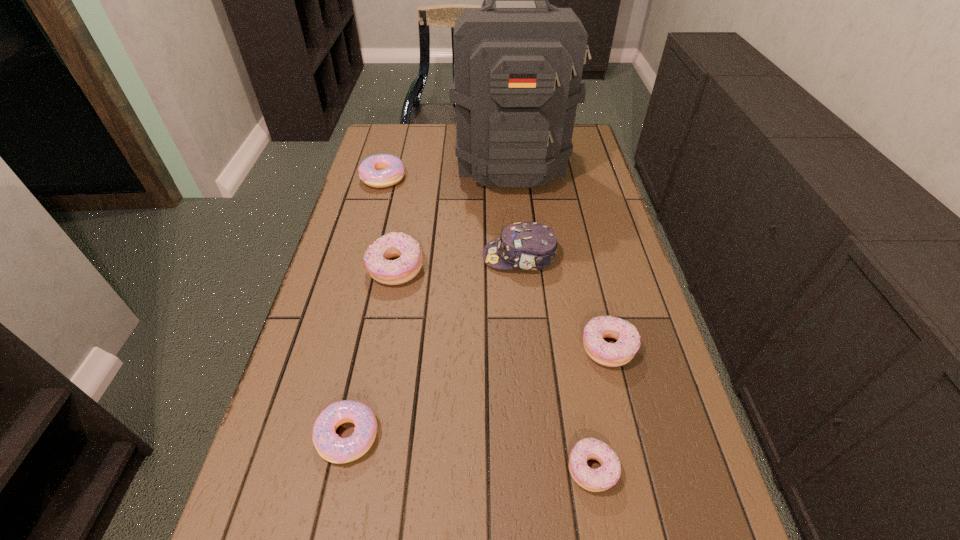
At what (x,y) coordinates should I click in order to perform the action: click on purple doughnut that is the second closest to the leftmost purple doughnut. Please return your answer as a coordinate pair (x, y). The height and width of the screenshot is (540, 960). Looking at the image, I should click on (600, 479).

Identify the location of pink doughnut identified as the second closest to the tallest doughnut. The image size is (960, 540). (331, 447).

Select which pink doughnut is the closest to the gray backpack. Please provide its 2D coordinates. Your answer should be formatted as a tuple, i.e. [(x, y)], where the tuple contains the x and y coordinates of a point satisfying the conditions above.

[(382, 170)]

Locate an element on the screen. free spot that satisfies the following two spatial constraints: 1. on the front side of the smaller pink doughnut; 2. on the right side of the smallest purple doughnut is located at coordinates click(340, 469).

Image resolution: width=960 pixels, height=540 pixels. In order to click on vacant space that satisfies the following two spatial constraints: 1. on the front-facing side of the headwear; 2. on the left side of the smallest purple doughnut in this screenshot , I will do `click(539, 469)`.

Find the location of a particular element. free spot that satisfies the following two spatial constraints: 1. on the front side of the farthest doughnut; 2. on the right side of the nearer pink doughnut is located at coordinates (313, 436).